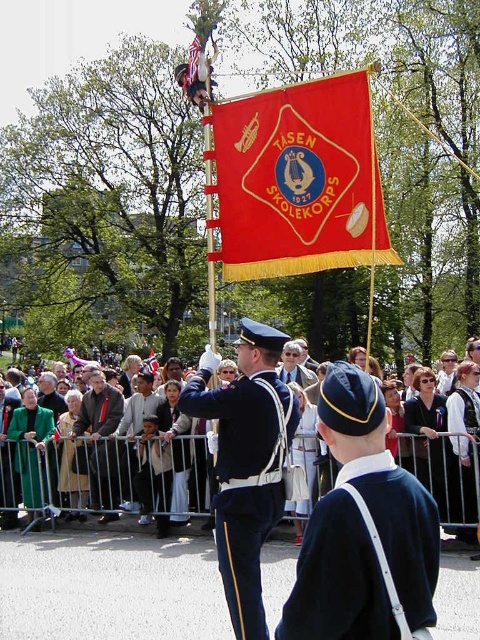
Based on the photo, can you confirm if light beige fabric crowd at center is wider than light gray fabric jacket at center?

Correct, the width of light beige fabric crowd at center exceeds that of light gray fabric jacket at center.

Is point (197, 465) farther from camera compared to point (159, 396)?

No, it is not.

The image size is (480, 640). Identify the location of light beige fabric crowd at center. (101, 468).

Who is lower down, green fabric coat at left or black fabric uniform at center?

green fabric coat at left

Is green fabric coat at left positioned before black fabric uniform at center?

That is False.

Is point (47, 435) farther from camera compared to point (463, 429)?

Yes.

Find the location of a particular element. The height and width of the screenshot is (640, 480). green fabric coat at left is located at coordinates (31, 448).

Measure the distance between light beige fabric crowd at center and black fabric uniform at center.

9.50 meters

Is light beige fabric crowd at center positioned before black fabric uniform at center?

Yes, it is.

Which is behind, point (309, 432) or point (467, 422)?

Positioned behind is point (309, 432).

What are the coordinates of `light beige fabric crowd at center` in the screenshot? It's located at (101, 468).